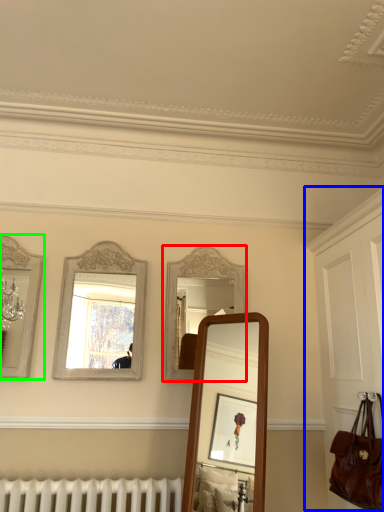
Question: Considering the real-world distances, which object is farthest from mirror (highlighted by a red box)? dresser (highlighted by a blue box) or mirror (highlighted by a green box)?

Choices:
 (A) dresser
 (B) mirror

Answer: (B)